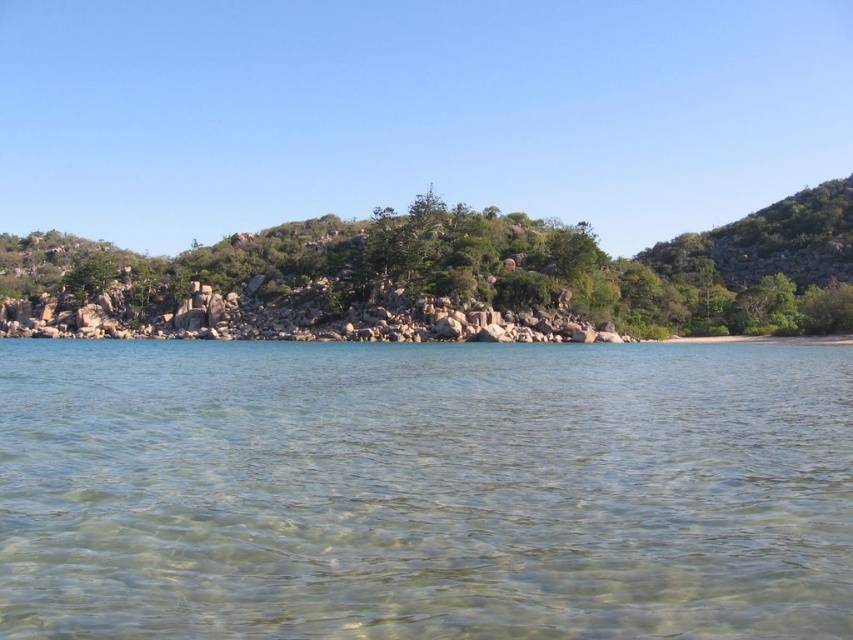
The image size is (853, 640). Describe the element at coordinates (424, 490) in the screenshot. I see `clear water at center` at that location.

Is point (165, 560) more distant than point (814, 280)?

No, (165, 560) is closer to viewer.

The width and height of the screenshot is (853, 640). What are the coordinates of `clear water at center` in the screenshot? It's located at (424, 490).